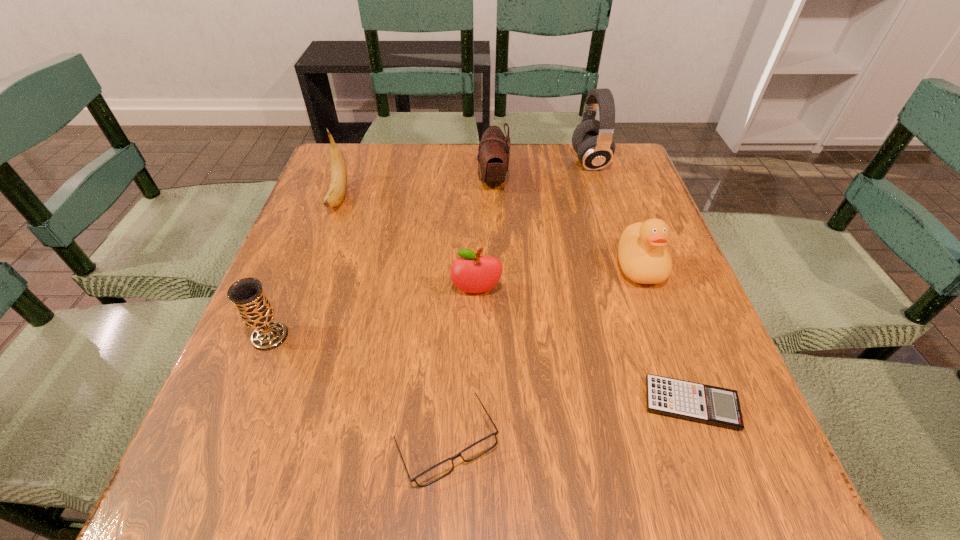
You are a GUI agent. You are given a task and a screenshot of the screen. Output one action in this format:
    pyautogui.click(x=<x>, y=<y>)
    Task: Click on the banana at the far edge
    
    Given the screenshot: What is the action you would take?
    pyautogui.click(x=337, y=189)

Where is `pouch at the far edge`? pouch at the far edge is located at coordinates (493, 155).

Where is `object present at the near edge`? The width and height of the screenshot is (960, 540). object present at the near edge is located at coordinates (477, 449).

At what (x,y) coordinates should I click in order to perform the action: click on banana that is at the left edge. Please return your answer as a coordinate pair (x, y). This screenshot has height=540, width=960. Looking at the image, I should click on (337, 189).

The image size is (960, 540). What are the coordinates of `chalice that is at the left edge` in the screenshot? It's located at 255,310.

At what (x,y) coordinates should I click in order to perform the action: click on headset located at the right edge. Please return your answer as a coordinate pair (x, y). This screenshot has width=960, height=540. Looking at the image, I should click on (592, 140).

Where is `duck that is at the right edge`? The image size is (960, 540). duck that is at the right edge is located at coordinates coord(643,258).

You are a GUI agent. You are given a task and a screenshot of the screen. Output one action in this format:
    pyautogui.click(x=<x>, y=<y>)
    Task: Click on the calculator at the right edge
    The image size is (960, 540).
    Given the screenshot: What is the action you would take?
    pyautogui.click(x=708, y=404)

Where is `object that is at the far left corner`? The width and height of the screenshot is (960, 540). object that is at the far left corner is located at coordinates (337, 189).

Find the location of a particular element. object that is at the far right corner is located at coordinates (592, 140).